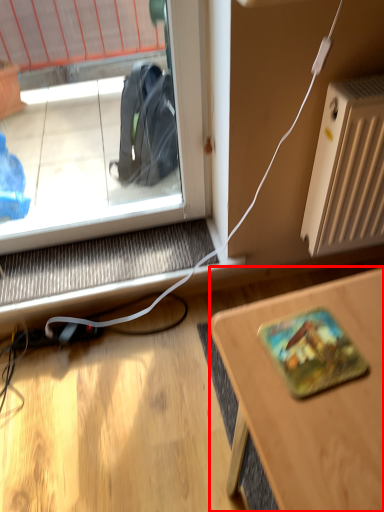
Question: From the image's perspective, what is the correct spatial relationship of desk (annotated by the red box) in relation to radiator?

Choices:
 (A) above
 (B) below

Answer: (B)